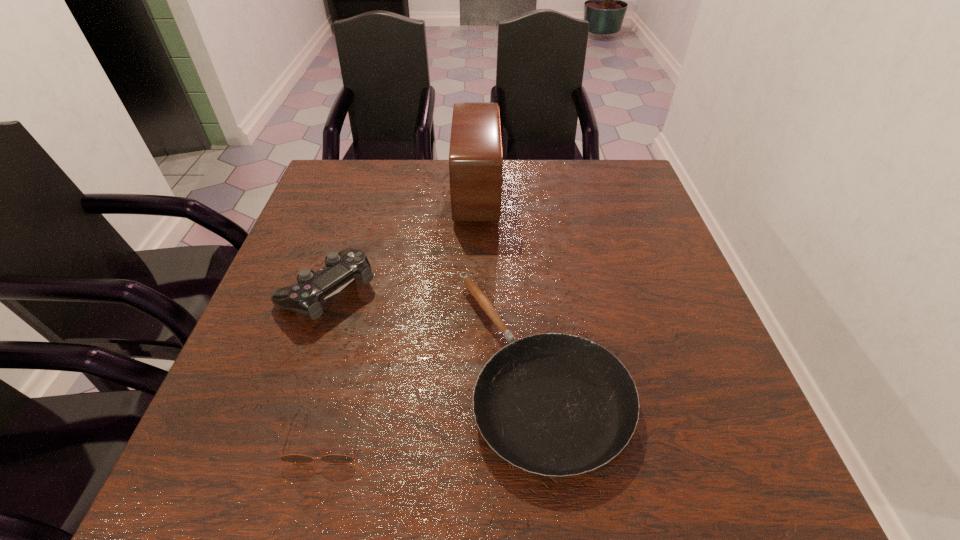
Locate which object ranks second in proximity to the control. Please provide its 2D coordinates. Your answer should be formatted as a tuple, i.e. [(x, y)], where the tuple contains the x and y coordinates of a point satisfying the conditions above.

[(293, 458)]

Find the location of `object that can be found as the second closest to the frying pan`. object that can be found as the second closest to the frying pan is located at coordinates (306, 297).

The height and width of the screenshot is (540, 960). I want to click on free space that satisfies the following two spatial constraints: 1. on the front-facing side of the radio receiver; 2. on the face of the shortest object, so click(474, 439).

Image resolution: width=960 pixels, height=540 pixels. I want to click on vacant space that satisfies the following two spatial constraints: 1. on the front-facing side of the farthest object; 2. on the face of the sunglasses, so 474,439.

Identify the location of free space that satisfies the following two spatial constraints: 1. on the front-facing side of the farthest object; 2. on the right side of the frying pan. Image resolution: width=960 pixels, height=540 pixels. (475, 367).

You are a GUI agent. You are given a task and a screenshot of the screen. Output one action in this format:
    pyautogui.click(x=<x>, y=<y>)
    Task: Click on the vacant space that satisfies the following two spatial constraints: 1. on the front-facing side of the tallest object; 2. on the face of the shortest object
    
    Given the screenshot: What is the action you would take?
    pyautogui.click(x=474, y=439)

You are a GUI agent. You are given a task and a screenshot of the screen. Output one action in this format:
    pyautogui.click(x=<x>, y=<y>)
    Task: Click on the vacant area in the image that satisfies the following two spatial constraints: 1. on the front side of the frying pan; 2. on the right side of the second tallest object
    
    Given the screenshot: What is the action you would take?
    pyautogui.click(x=302, y=367)

Find the location of a particular element. vacant area that satisfies the following two spatial constraints: 1. on the front-facing side of the tallest object; 2. on the face of the shortest object is located at coordinates (474, 439).

The width and height of the screenshot is (960, 540). I want to click on vacant space that satisfies the following two spatial constraints: 1. on the front-facing side of the tallest object; 2. on the back side of the frying pan, so click(475, 367).